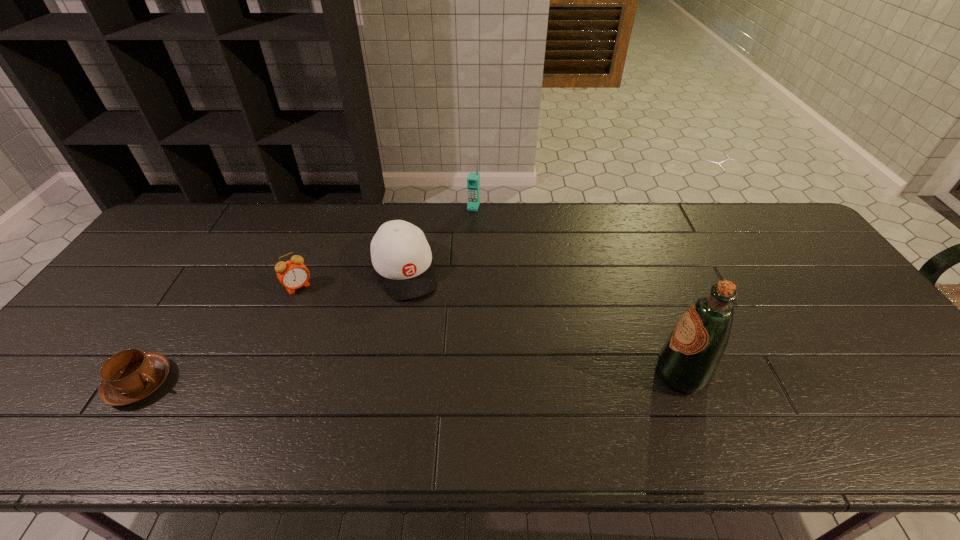
This screenshot has height=540, width=960. What are the coordinates of `vacant area situated on the keypad of the fourth shortest object` in the screenshot? It's located at coord(458,251).

Where is `baseball cap positioned at the far edge`? The height and width of the screenshot is (540, 960). baseball cap positioned at the far edge is located at coordinates (400, 253).

Find the location of `cellular telephone at the far edge`. cellular telephone at the far edge is located at coordinates click(473, 181).

At what (x,y) coordinates should I click in order to perform the action: click on cappuccino present at the near edge. Please return your answer as a coordinate pair (x, y). Image resolution: width=960 pixels, height=540 pixels. Looking at the image, I should click on (129, 376).

Identify the location of olive oil situated at the near edge. Image resolution: width=960 pixels, height=540 pixels. (687, 362).

The height and width of the screenshot is (540, 960). Find the location of `blank area at the far edge`. blank area at the far edge is located at coordinates (593, 220).

In the image, there is a desktop. Identify the location of free space at the near edge. (300, 376).

Locate an element on the screen. This screenshot has width=960, height=540. vacant space at the left edge of the desktop is located at coordinates (140, 273).

Identify the location of free space at the right edge of the desktop. (822, 284).

The height and width of the screenshot is (540, 960). What are the coordinates of `vacant space at the far right corner` in the screenshot? It's located at (789, 242).